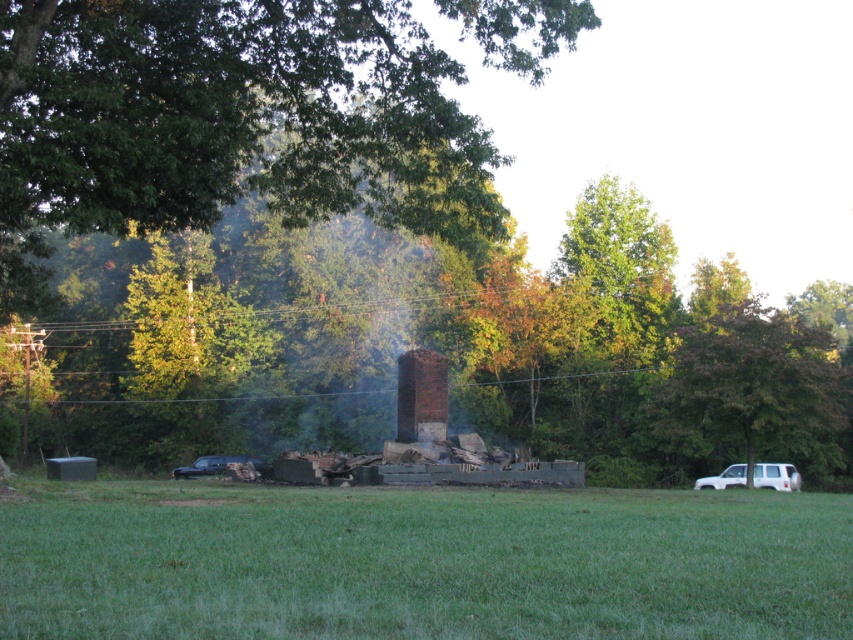
Who is more distant from viewer, (397, 372) or (178, 476)?

The point (397, 372) is behind.

Find the location of `brick chimney at center`. brick chimney at center is located at coordinates (421, 396).

What do you see at coordinates (225, 122) in the screenshot? I see `green leafy tree at upper center` at bounding box center [225, 122].

Does green leafy tree at upper center appear on the left side of black matte car at lower left?

No, green leafy tree at upper center is not to the left of black matte car at lower left.

Describe the element at coordinates (225, 122) in the screenshot. I see `green leafy tree at upper center` at that location.

Identify the location of green leafy tree at upper center. Image resolution: width=853 pixels, height=640 pixels. (225, 122).

Does brick chimney at center have a greater height compared to white matte suv at lower right?

Correct, brick chimney at center is much taller as white matte suv at lower right.

You are a GUI agent. You are given a task and a screenshot of the screen. Output one action in this format:
    pyautogui.click(x=<x>, y=<y>)
    Task: Click on the brick chimney at center
    
    Given the screenshot: What is the action you would take?
    pyautogui.click(x=421, y=396)